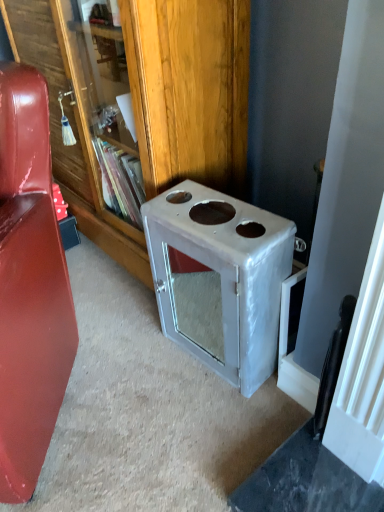
In order to click on glossy leather couch at left in this screenshot , I will do tap(29, 286).

What do you see at coordinates (219, 278) in the screenshot? The height and width of the screenshot is (512, 384). I see `white glossy stove at center` at bounding box center [219, 278].

Where is `glossy leather couch at left`? The image size is (384, 512). glossy leather couch at left is located at coordinates (29, 286).

Can you tell me how much metallic silver bookcase at center and white glossy stove at center differ in facing direction?

The angular difference between metallic silver bookcase at center and white glossy stove at center is 4.13 degrees.

From their relative heights in the image, would you say metallic silver bookcase at center is taller or shorter than white glossy stove at center?

Clearly, metallic silver bookcase at center is taller compared to white glossy stove at center.

Considering the relative sizes of metallic silver bookcase at center and white glossy stove at center in the image provided, is metallic silver bookcase at center bigger than white glossy stove at center?

Yes, metallic silver bookcase at center is bigger than white glossy stove at center.

Is metallic silver bookcase at center situated inside white glossy stove at center or outside?

metallic silver bookcase at center is spatially situated outside white glossy stove at center.

In terms of width, does white glossy stove at center look wider or thinner when compared to glossy leather couch at left?

Clearly, white glossy stove at center has less width compared to glossy leather couch at left.

Is white glossy stove at center located outside glossy leather couch at left?

That's correct, white glossy stove at center is outside of glossy leather couch at left.

Can you confirm if white glossy stove at center is smaller than glossy leather couch at left?

Correct, white glossy stove at center occupies less space than glossy leather couch at left.

From the image's perspective, is white glossy stove at center located beneath metallic silver bookcase at center?

Indeed, from the image's perspective, white glossy stove at center is shown beneath metallic silver bookcase at center.

Is white glossy stove at center shorter than metallic silver bookcase at center?

Yes.

I want to click on appliance located underneath the metallic silver bookcase at center (from a real-world perspective), so click(x=219, y=278).

Which is closer to the camera, (17, 196) or (149, 84)?

The point (17, 196) is closer to the camera.

Considering the relative positions of glossy leather couch at left and metallic silver bookcase at center in the image provided, is glossy leather couch at left to the left or to the right of metallic silver bookcase at center?

From the image, it's evident that glossy leather couch at left is to the left of metallic silver bookcase at center.

From a real-world perspective, is glossy leather couch at left above or below metallic silver bookcase at center?

From a real-world perspective, glossy leather couch at left is physically below metallic silver bookcase at center.

Is glossy leather couch at left oriented away from metallic silver bookcase at center?

Yes, metallic silver bookcase at center is at the back of glossy leather couch at left.

Considering the sizes of objects glossy leather couch at left and white glossy stove at center in the image provided, who is wider, glossy leather couch at left or white glossy stove at center?

With larger width is glossy leather couch at left.

Is glossy leather couch at left to the right of white glossy stove at center from the viewer's perspective?

Incorrect, glossy leather couch at left is not on the right side of white glossy stove at center.

Does glossy leather couch at left come in front of white glossy stove at center?

Yes, glossy leather couch at left is in front of white glossy stove at center.

Measure the distance between glossy leather couch at left and white glossy stove at center.

glossy leather couch at left is 15.98 inches from white glossy stove at center.

Does metallic silver bookcase at center have a lesser width compared to glossy leather couch at left?

Yes, metallic silver bookcase at center is thinner than glossy leather couch at left.

From a real-world perspective, does metallic silver bookcase at center stand above glossy leather couch at left?

Yes, from a real-world perspective, metallic silver bookcase at center is over glossy leather couch at left

Does point (95, 231) appear closer or farther from the camera than point (9, 310)?

Point (95, 231) appears to be farther away from the viewer than point (9, 310).

Looking at the image, does metallic silver bookcase at center seem bigger or smaller compared to glossy leather couch at left?

metallic silver bookcase at center is bigger than glossy leather couch at left.

In the image, there is a white glossy stove at center. Where is `bookcase above it (from the image's perspective)`? The width and height of the screenshot is (384, 512). bookcase above it (from the image's perspective) is located at coordinates (141, 99).

The width and height of the screenshot is (384, 512). I want to click on furniture located on the left of white glossy stove at center, so click(29, 286).

When comparing their distances from white glossy stove at center, does glossy leather couch at left or metallic silver bookcase at center seem closer?

metallic silver bookcase at center lies closer to white glossy stove at center than the other object.

Looking at the image, which one is located further to glossy leather couch at left, metallic silver bookcase at center or white glossy stove at center?

metallic silver bookcase at center lies further to glossy leather couch at left than the other object.

Based on their spatial positions, is white glossy stove at center or glossy leather couch at left further from metallic silver bookcase at center?

Among the two, glossy leather couch at left is located further to metallic silver bookcase at center.

From the image, which object appears to be nearer to glossy leather couch at left, white glossy stove at center or metallic silver bookcase at center?

Among the two, white glossy stove at center is located nearer to glossy leather couch at left.

Based on their spatial positions, is glossy leather couch at left or white glossy stove at center further from metallic silver bookcase at center?

Based on the image, glossy leather couch at left appears to be further to metallic silver bookcase at center.

Looking at the image, which one is located further to white glossy stove at center, metallic silver bookcase at center or glossy leather couch at left?

glossy leather couch at left is further to white glossy stove at center.

The image size is (384, 512). Find the location of `furniture between metallic silver bookcase at center and white glossy stove at center in the up-down direction`. furniture between metallic silver bookcase at center and white glossy stove at center in the up-down direction is located at coordinates (29, 286).